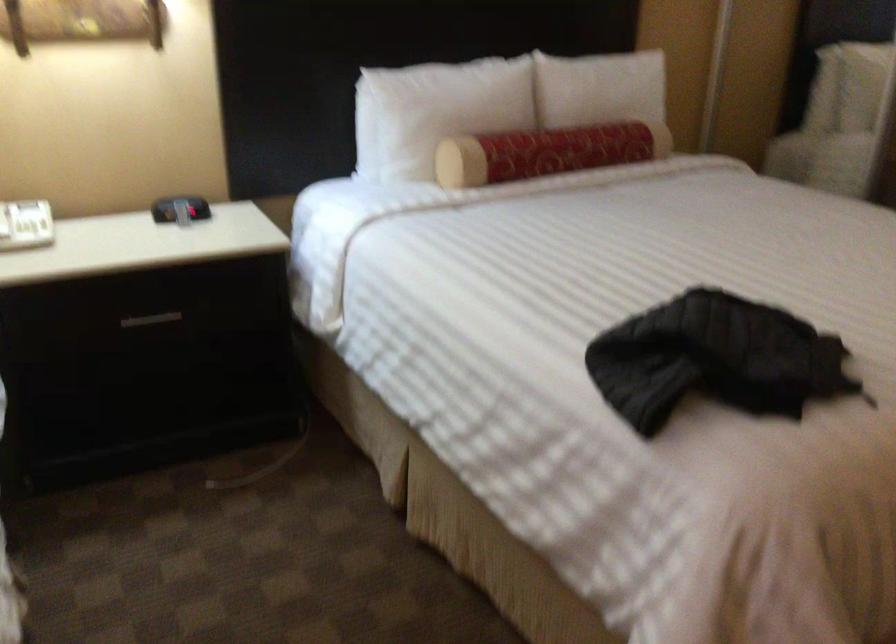
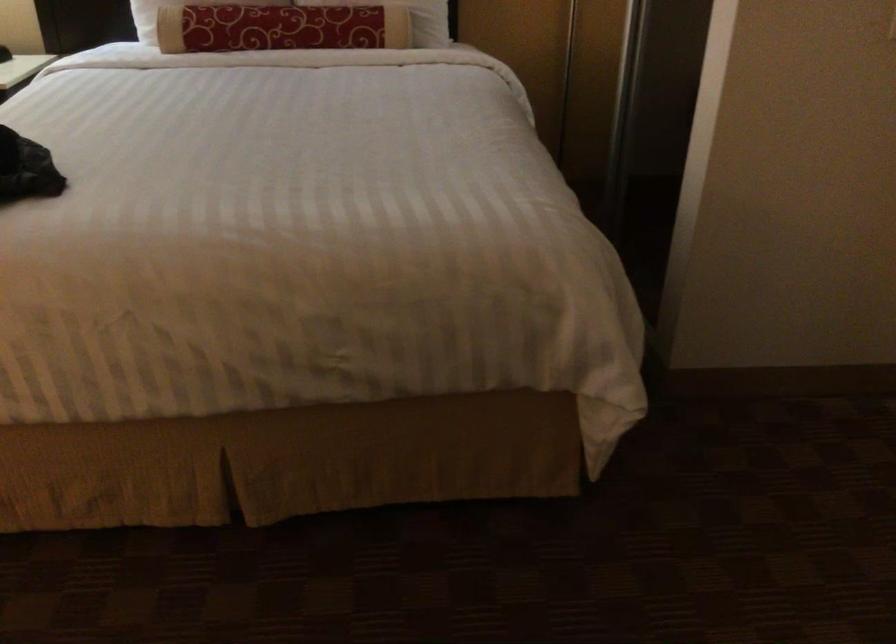
Where in the second image is the point corresponding to point 599,131 from the first image?

(311, 15)